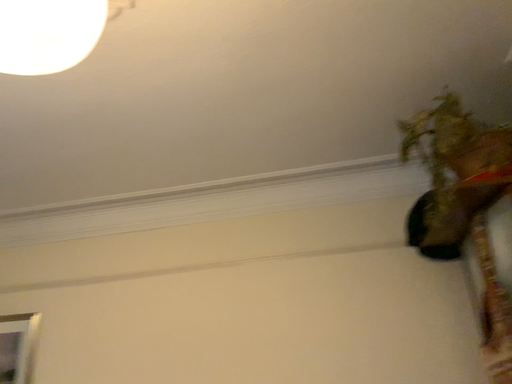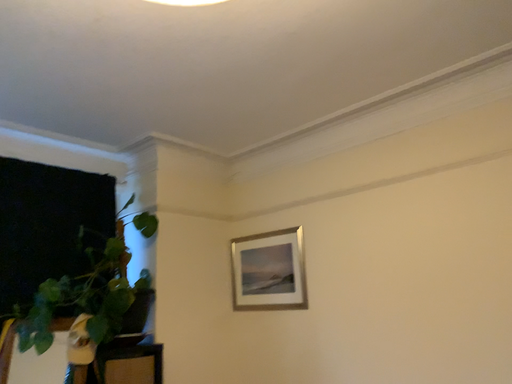
Question: How did the camera likely rotate when shooting the video?

Choices:
 (A) rotated upward
 (B) rotated downward

Answer: (B)